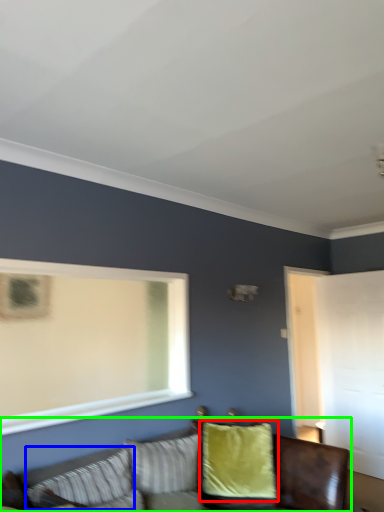
Question: Estimate the real-world distances between objects in this image. Which object is farther from pillow (highlighted by a red box), pillow (highlighted by a blue box) or studio couch (highlighted by a green box)?

Choices:
 (A) pillow
 (B) studio couch

Answer: (A)